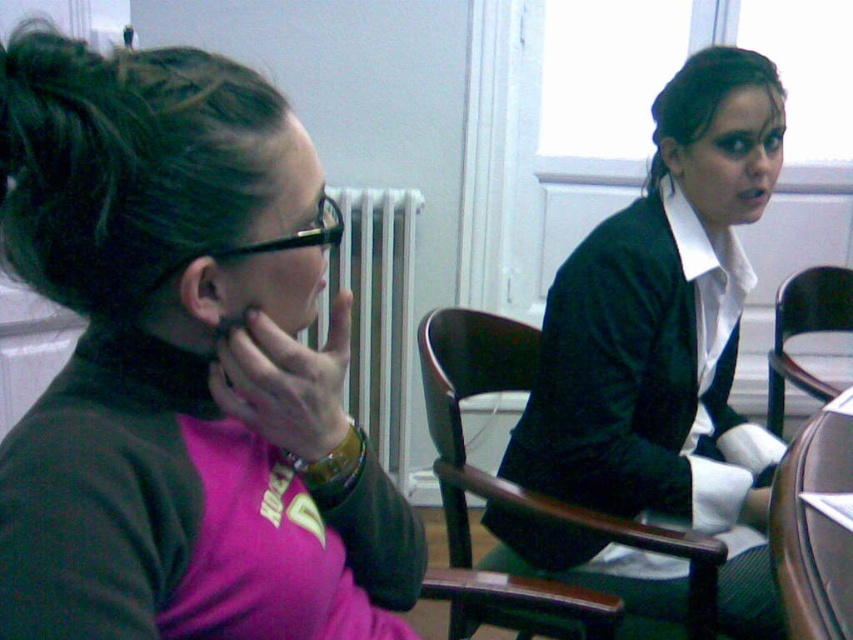
Question: Which object appears farthest from the camera in this image?

Choices:
 (A) black wood chair at right
 (B) dark wood chair at center
 (C) velvet green dress at center

Answer: (A)

Question: Considering the relative positions of dark wood chair at center and black wood chair at right in the image provided, where is dark wood chair at center located with respect to black wood chair at right?

Choices:
 (A) right
 (B) left

Answer: (B)

Question: Is dark wood chair at center below black wood chair at right?

Choices:
 (A) no
 (B) yes

Answer: (B)

Question: Estimate the real-world distances between objects in this image. Which object is farther from the dark wood chair at center?

Choices:
 (A) brown leather round table at lower right
 (B) velvet green dress at center

Answer: (A)

Question: Among these objects, which one is nearest to the camera?

Choices:
 (A) white radiator at center
 (B) pink matte turtleneck at left
 (C) brown leather round table at lower right

Answer: (B)

Question: Does pink matte turtleneck at left appear on the left side of black wood chair at right?

Choices:
 (A) no
 (B) yes

Answer: (B)